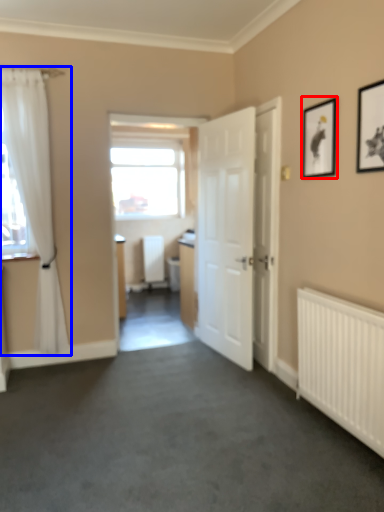
Question: Which object is further to the camera taking this photo, picture frame (highlighted by a red box) or curtain (highlighted by a blue box)?

Choices:
 (A) picture frame
 (B) curtain

Answer: (B)